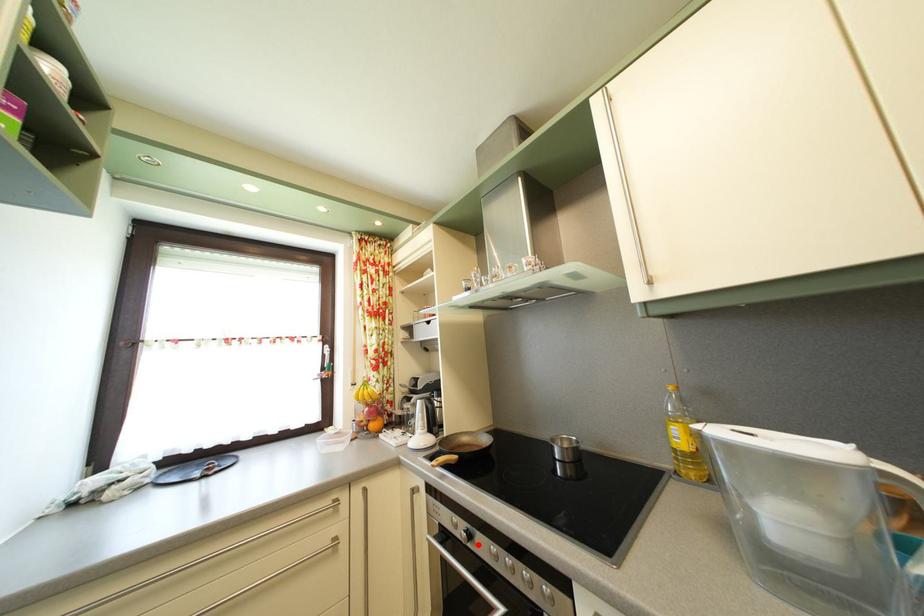
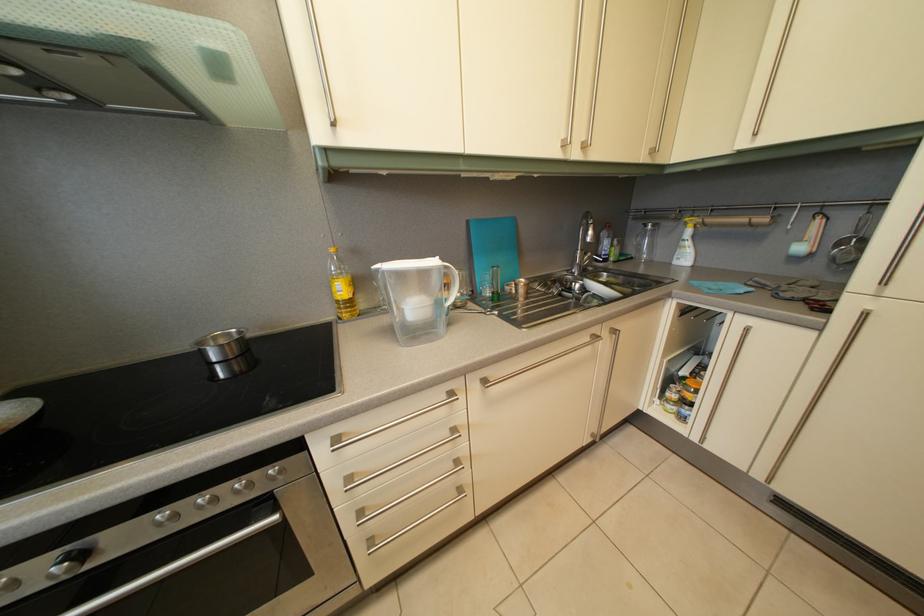
In the second image, find the point that corresponds to the highlighted location in the first image.

(92, 562)